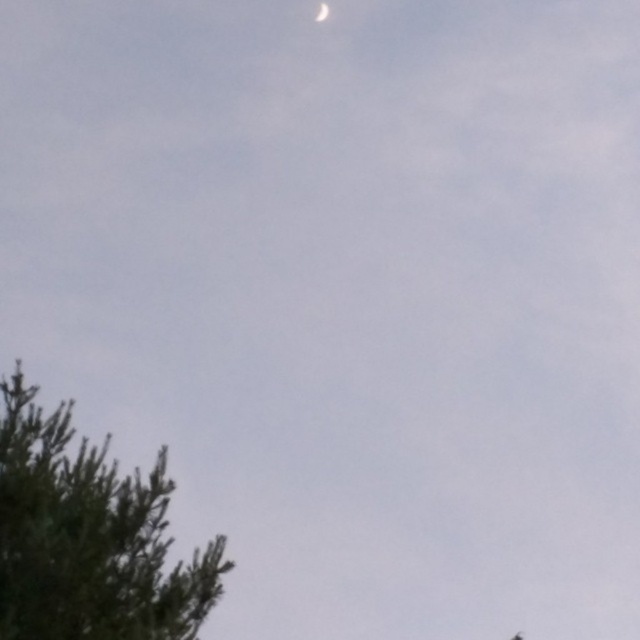
Question: Does green textured tree at lower left have a greater width compared to white glossy moon at upper center?

Choices:
 (A) no
 (B) yes

Answer: (B)

Question: Which point is closer to the camera taking this photo?

Choices:
 (A) (317, 13)
 (B) (99, 499)

Answer: (B)

Question: Can you confirm if green textured tree at lower left is smaller than white glossy moon at upper center?

Choices:
 (A) no
 (B) yes

Answer: (A)

Question: Is green textured tree at lower left wider than white glossy moon at upper center?

Choices:
 (A) no
 (B) yes

Answer: (B)

Question: Among these points, which one is farthest from the camera?

Choices:
 (A) (198, 556)
 (B) (316, 16)

Answer: (B)